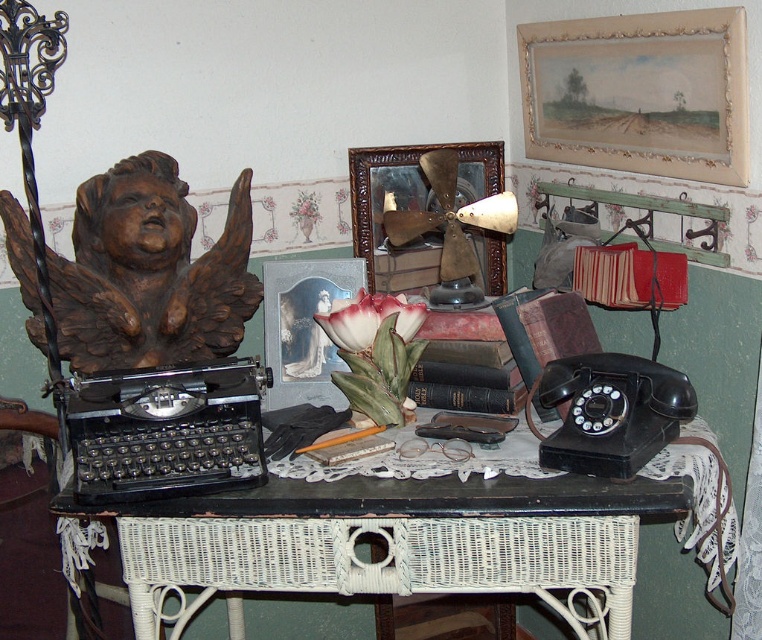
Can you confirm if watercolor paper painting at upper right is positioned to the right of gold-bronze picture frame at center?

Yes, watercolor paper painting at upper right is to the right of gold-bronze picture frame at center.

Is watercolor paper painting at upper right above gold-bronze picture frame at center?

Correct, watercolor paper painting at upper right is located above gold-bronze picture frame at center.

Identify the location of watercolor paper painting at upper right. (639, 93).

Image resolution: width=762 pixels, height=640 pixels. I want to click on watercolor paper painting at upper right, so click(x=639, y=93).

Is black painted wood table at center to the right of gold-bronze picture frame at center from the viewer's perspective?

Incorrect, black painted wood table at center is not on the right side of gold-bronze picture frame at center.

Measure the distance between point (370, 589) and camera.

A distance of 1.47 meters exists between point (370, 589) and camera.

Where is `black painted wood table at center`? This screenshot has width=762, height=640. black painted wood table at center is located at coordinates (388, 532).

Between gold-bronze picture frame at center and metallic silver picture frame at center, which one is positioned lower?

metallic silver picture frame at center

Is gold-bronze picture frame at center positioned in front of metallic silver picture frame at center?

That is False.

Who is more distant from viewer, (482,160) or (290,260)?

Point (482,160)

This screenshot has height=640, width=762. In order to click on gold-bronze picture frame at center in this screenshot , I will do pyautogui.click(x=434, y=216).